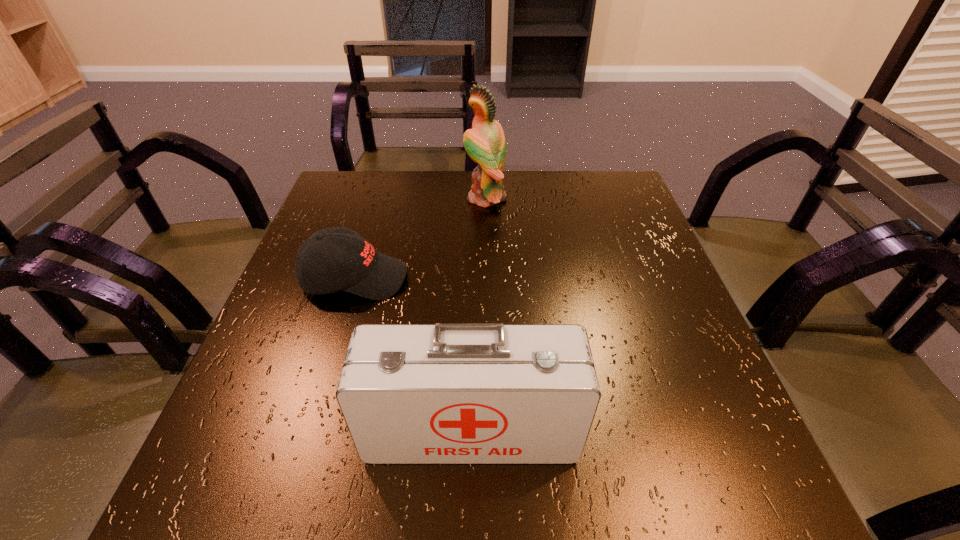
The width and height of the screenshot is (960, 540). Identify the location of parrot. click(485, 143).

Where is `the tallest object`? Image resolution: width=960 pixels, height=540 pixels. the tallest object is located at coordinates (485, 143).

Identify the location of the first-aid kit. (446, 393).

Where is `the nearest object`? The image size is (960, 540). the nearest object is located at coordinates (446, 393).

The image size is (960, 540). Identify the location of the second nearest object. (361, 270).

Locate an element on the screen. The height and width of the screenshot is (540, 960). the shortest object is located at coordinates coord(361,270).

Find the location of a particular element. The image size is (960, 540). free region located on the front-facing side of the farthest object is located at coordinates (424, 198).

Find the location of a particular element. The width and height of the screenshot is (960, 540). vacant space positioned 0.300m on the front-facing side of the farthest object is located at coordinates (354, 198).

The width and height of the screenshot is (960, 540). I want to click on vacant space situated 0.190m on the front-facing side of the farthest object, so click(x=395, y=198).

This screenshot has width=960, height=540. I want to click on free space located on the front-facing side of the shortest object, so click(x=493, y=278).